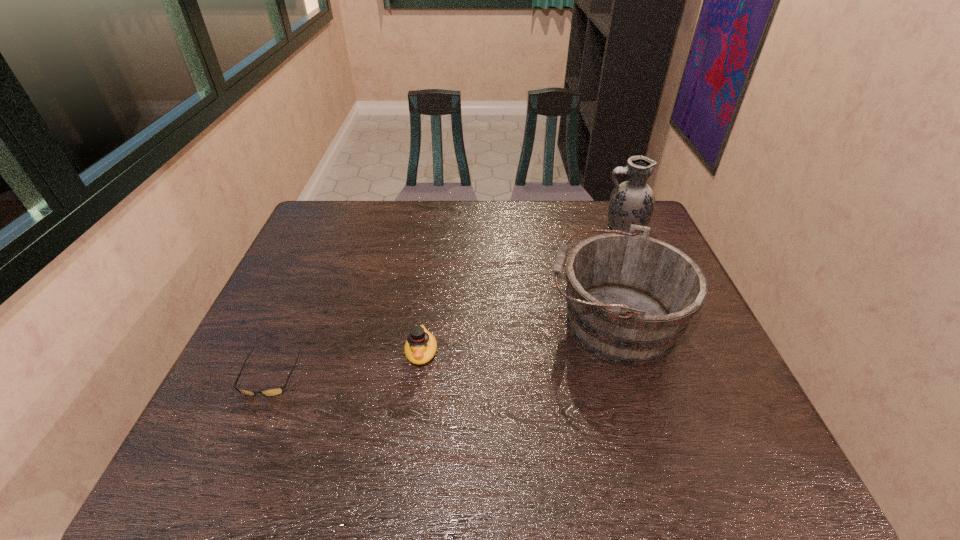
You are a GUI agent. You are given a task and a screenshot of the screen. Output one action in this format:
    pyautogui.click(x=<x>, y=<y>)
    Task: Click on the free space located 0.120m on the left of the wine bucket
    This screenshot has height=540, width=960.
    Given the screenshot: What is the action you would take?
    pyautogui.click(x=499, y=322)

The image size is (960, 540). Find the location of `vacant space located 0.110m on the front-facing side of the duck`. vacant space located 0.110m on the front-facing side of the duck is located at coordinates (414, 413).

Find the location of a particular element. blank area located 0.120m on the front-facing side of the leftmost object is located at coordinates (237, 451).

The height and width of the screenshot is (540, 960). In order to click on object located at the far edge in this screenshot , I will do `click(632, 202)`.

The image size is (960, 540). Identify the location of object at the left edge. (274, 391).

Locate an element on the screen. The height and width of the screenshot is (540, 960). vase present at the right edge is located at coordinates (632, 202).

This screenshot has height=540, width=960. I want to click on wine bucket at the right edge, so click(629, 297).

Where is `object present at the far right corner`? This screenshot has height=540, width=960. object present at the far right corner is located at coordinates (632, 202).

You are a GUI agent. You are given a task and a screenshot of the screen. Output one action in this format:
    pyautogui.click(x=<x>, y=<y>)
    Task: Click on the free space at the far edge of the desktop
    The width and height of the screenshot is (960, 540).
    Given the screenshot: What is the action you would take?
    pyautogui.click(x=535, y=204)

Locate an element on the screen. free space at the near edge of the desktop is located at coordinates (577, 486).